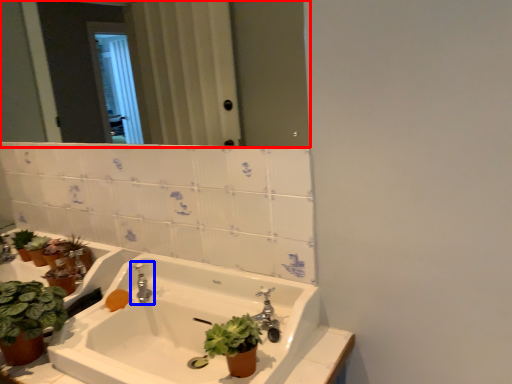
Question: Among these objects, which one is nearest to the camera, mirror (highlighted by a red box) or tap (highlighted by a blue box)?

Choices:
 (A) mirror
 (B) tap

Answer: (A)